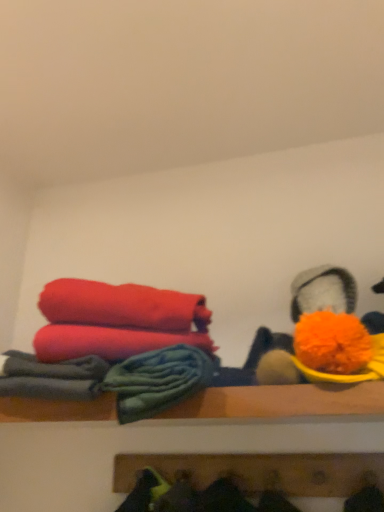
Describe the element at coordinates (282, 402) in the screenshot. I see `wooden shelf at center, placed as the 2th shelf when sorted from bottom to top` at that location.

Describe the element at coordinates (157, 380) in the screenshot. I see `soft cotton towels at left` at that location.

The image size is (384, 512). What do you see at coordinates (323, 292) in the screenshot? I see `fluffy orange pom-pom at upper right` at bounding box center [323, 292].

This screenshot has width=384, height=512. I want to click on wooden shelf at center, the 1th shelf when ordered from top to bottom, so click(x=282, y=402).

Which of these two, fluffy orange pom-pom at upper right or matte red towel at left, is thinner?

matte red towel at left is thinner.

Which is nearer, (314, 277) or (117, 317)?

The point (117, 317) is closer to the camera.

How different are the orientations of fluffy orange pom-pom at upper right and matte red towel at left in degrees?

The angle between the facing direction of fluffy orange pom-pom at upper right and the facing direction of matte red towel at left is 1.55e-05 degrees.

Considering the relative sizes of fluffy orange pom-pom at upper right and matte red towel at left in the image provided, is fluffy orange pom-pom at upper right shorter than matte red towel at left?

In fact, fluffy orange pom-pom at upper right may be taller than matte red towel at left.

Is fluffy orange pom-pom at upper right oriented towards wooden shelf at center, placed as the 2th shelf when sorted from bottom to top?

No, fluffy orange pom-pom at upper right is not turned towards wooden shelf at center, placed as the 2th shelf when sorted from bottom to top.

Is fluffy orange pom-pom at upper right next to wooden shelf at center, the 1th shelf when ordered from top to bottom?

No, fluffy orange pom-pom at upper right is not making contact with wooden shelf at center, the 1th shelf when ordered from top to bottom.

Can you confirm if fluffy orange pom-pom at upper right is positioned to the right of wooden shelf at center, placed as the 2th shelf when sorted from bottom to top?

Yes, fluffy orange pom-pom at upper right is to the right of wooden shelf at center, placed as the 2th shelf when sorted from bottom to top.

In the image, is wooden shelf at center, placed as the 2th shelf when sorted from bottom to top, on the left side or the right side of fluffy orange pom-pom at upper right?

Clearly, wooden shelf at center, placed as the 2th shelf when sorted from bottom to top, is on the left of fluffy orange pom-pom at upper right in the image.

Is wooden shelf at center, placed as the 2th shelf when sorted from bottom to top, placed right next to fluffy orange pom-pom at upper right?

wooden shelf at center, placed as the 2th shelf when sorted from bottom to top, and fluffy orange pom-pom at upper right are clearly separated.

In terms of height, does wooden shelf at center, placed as the 2th shelf when sorted from bottom to top, look taller or shorter compared to fluffy orange pom-pom at upper right?

wooden shelf at center, placed as the 2th shelf when sorted from bottom to top, is shorter than fluffy orange pom-pom at upper right.

Can you confirm if wooden coat rack at lower center, placed as the 1th shelf when sorted from bottom to top, is thinner than soft cotton towels at left?

No, wooden coat rack at lower center, placed as the 1th shelf when sorted from bottom to top, is not thinner than soft cotton towels at left.

Is wooden coat rack at lower center, placed as the 1th shelf when sorted from bottom to top, further to camera compared to soft cotton towels at left?

Yes, it is.

Considering the positions of objects wooden coat rack at lower center, placed as the 1th shelf when sorted from bottom to top, and soft cotton towels at left in the image provided, who is more to the left, wooden coat rack at lower center, placed as the 1th shelf when sorted from bottom to top, or soft cotton towels at left?

soft cotton towels at left.

Is wooden coat rack at lower center, which is counted as the 2th shelf, starting from the top, at the right side of fluffy orange pom-pom at upper right?

Incorrect, wooden coat rack at lower center, which is counted as the 2th shelf, starting from the top, is not on the right side of fluffy orange pom-pom at upper right.

Does wooden coat rack at lower center, which is counted as the 2th shelf, starting from the top, have a lesser width compared to fluffy orange pom-pom at upper right?

Yes.

Is fluffy orange pom-pom at upper right further to the viewer compared to wooden coat rack at lower center, placed as the 1th shelf when sorted from bottom to top?

No.

How many degrees apart are the facing directions of fluffy orange pom-pom at upper right and wooden coat rack at lower center, which is counted as the 2th shelf, starting from the top?

They differ by 3.88 degrees in their facing directions.

Between fluffy orange pom-pom at upper right and wooden coat rack at lower center, which is counted as the 2th shelf, starting from the top, which one has smaller size?

wooden coat rack at lower center, which is counted as the 2th shelf, starting from the top.

Which point is more forward, [261,384] or [167,455]?

The point [261,384] is closer to the camera.

Are wooden shelf at center, placed as the 2th shelf when sorted from bottom to top, and soft cotton towels at left located far from each other?

They are positioned close to each other.

Considering the relative sizes of wooden shelf at center, placed as the 2th shelf when sorted from bottom to top, and soft cotton towels at left in the image provided, is wooden shelf at center, placed as the 2th shelf when sorted from bottom to top, shorter than soft cotton towels at left?

Indeed, wooden shelf at center, placed as the 2th shelf when sorted from bottom to top, has a lesser height compared to soft cotton towels at left.

From a real-world perspective, does wooden shelf at center, placed as the 2th shelf when sorted from bottom to top, stand above soft cotton towels at left?

Actually, wooden shelf at center, placed as the 2th shelf when sorted from bottom to top, is physically below soft cotton towels at left in the real world.

Is wooden shelf at center, placed as the 2th shelf when sorted from bottom to top, in front of or behind soft cotton towels at left in the image?

Visually, wooden shelf at center, placed as the 2th shelf when sorted from bottom to top, is located in front of soft cotton towels at left.

At what (x,y) coordinates should I click in order to perform the action: click on toy on the right of matte red towel at left. Please return your answer as a coordinate pair (x, y). The height and width of the screenshot is (512, 384). Looking at the image, I should click on (323, 292).

Where is `the 1st shelf positioned below the fluffy orange pom-pom at upper right (from the image's perspective)`? the 1st shelf positioned below the fluffy orange pom-pom at upper right (from the image's perspective) is located at coordinates (282, 402).

Based on their spatial positions, is wooden shelf at center, the 1th shelf when ordered from top to bottom, or soft cotton towels at left closer to wooden coat rack at lower center, which is counted as the 2th shelf, starting from the top?

wooden shelf at center, the 1th shelf when ordered from top to bottom.

Consider the image. Based on their spatial positions, is matte red towel at left or wooden shelf at center, placed as the 2th shelf when sorted from bottom to top, further from soft cotton towels at left?

Among the two, matte red towel at left is located further to soft cotton towels at left.

Based on their spatial positions, is soft cotton towels at left or fluffy orange pom-pom at upper right further from matte red towel at left?

Based on the image, fluffy orange pom-pom at upper right appears to be further to matte red towel at left.

In the scene shown: From the image, which object appears to be nearer to wooden coat rack at lower center, placed as the 1th shelf when sorted from bottom to top, matte red towel at left or soft cotton towels at left?

soft cotton towels at left.

Looking at the image, which one is located further to fluffy orange pom-pom at upper right, soft cotton towels at left or wooden coat rack at lower center, which is counted as the 2th shelf, starting from the top?

wooden coat rack at lower center, which is counted as the 2th shelf, starting from the top, is positioned further to the anchor fluffy orange pom-pom at upper right.

Looking at the image, which one is located closer to matte red towel at left, soft cotton towels at left or wooden shelf at center, placed as the 2th shelf when sorted from bottom to top?

Among the two, soft cotton towels at left is located nearer to matte red towel at left.

Based on their spatial positions, is soft cotton towels at left or wooden coat rack at lower center, which is counted as the 2th shelf, starting from the top, further from wooden shelf at center, the 1th shelf when ordered from top to bottom?

Among the two, wooden coat rack at lower center, which is counted as the 2th shelf, starting from the top, is located further to wooden shelf at center, the 1th shelf when ordered from top to bottom.

Looking at the image, which one is located further to wooden coat rack at lower center, which is counted as the 2th shelf, starting from the top, soft cotton towels at left or matte red towel at left?

Based on the image, matte red towel at left appears to be further to wooden coat rack at lower center, which is counted as the 2th shelf, starting from the top.

Identify the location of shelf between soft cotton towels at left and wooden coat rack at lower center, placed as the 1th shelf when sorted from bottom to top, from left to right. The height and width of the screenshot is (512, 384). (282, 402).

This screenshot has width=384, height=512. Identify the location of material that lies between matte red towel at left and wooden shelf at center, placed as the 2th shelf when sorted from bottom to top, from top to bottom. (157, 380).

At what (x,y) coordinates should I click in order to perform the action: click on shelf that lies between fluffy orange pom-pom at upper right and wooden coat rack at lower center, placed as the 1th shelf when sorted from bottom to top, from top to bottom. Please return your answer as a coordinate pair (x, y). The height and width of the screenshot is (512, 384). Looking at the image, I should click on (282, 402).

At what (x,y) coordinates should I click in order to perform the action: click on shelf that lies between matte red towel at left and wooden coat rack at lower center, which is counted as the 2th shelf, starting from the top, from top to bottom. Please return your answer as a coordinate pair (x, y). This screenshot has width=384, height=512. Looking at the image, I should click on (282, 402).